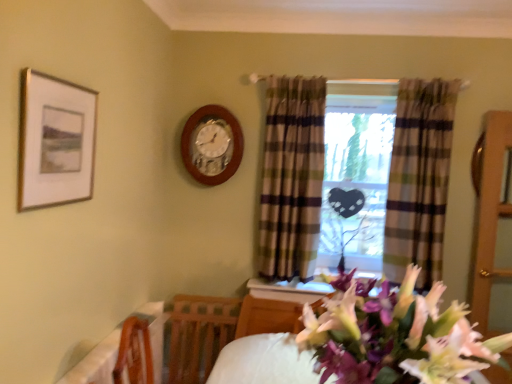
Question: Could you tell me if gold-framed picture at upper left is facing wooden table at lower left?

Choices:
 (A) yes
 (B) no

Answer: (B)

Question: Is gold-framed picture at upper left beside wooden table at lower left?

Choices:
 (A) no
 (B) yes

Answer: (A)

Question: Can you confirm if gold-framed picture at upper left is positioned to the right of wooden table at lower left?

Choices:
 (A) yes
 (B) no

Answer: (B)

Question: Is wooden table at lower left completely or partially inside gold-framed picture at upper left?

Choices:
 (A) no
 (B) yes

Answer: (A)

Question: Considering the relative positions of gold-framed picture at upper left and wooden table at lower left in the image provided, is gold-framed picture at upper left in front of wooden table at lower left?

Choices:
 (A) no
 (B) yes

Answer: (B)

Question: From a real-world perspective, is plaid fabric curtain at center, arranged as the 1th curtain when viewed from the left, above or below plaid fabric window at center?

Choices:
 (A) below
 (B) above

Answer: (B)

Question: Considering their positions, is plaid fabric curtain at center, the second curtain from the right, located in front of or behind plaid fabric window at center?

Choices:
 (A) behind
 (B) front

Answer: (B)

Question: Does point (267, 195) appear closer or farther from the camera than point (406, 261)?

Choices:
 (A) closer
 (B) farther

Answer: (B)

Question: Considering the positions of plaid fabric curtain at center, arranged as the 1th curtain when viewed from the left, and plaid fabric window at center in the image, is plaid fabric curtain at center, arranged as the 1th curtain when viewed from the left, wider or thinner than plaid fabric window at center?

Choices:
 (A) wide
 (B) thin

Answer: (B)

Question: From a real-world perspective, relative to wooden wall clock at center, is pink silky flowers at center vertically above or below?

Choices:
 (A) above
 (B) below

Answer: (B)

Question: From the image's perspective, relative to wooden wall clock at center, is pink silky flowers at center above or below?

Choices:
 (A) below
 (B) above

Answer: (A)

Question: In terms of width, does pink silky flowers at center look wider or thinner when compared to wooden wall clock at center?

Choices:
 (A) thin
 (B) wide

Answer: (B)

Question: In the image, is pink silky flowers at center on the left side or the right side of wooden wall clock at center?

Choices:
 (A) left
 (B) right

Answer: (B)

Question: From the image's perspective, is gold-framed picture at upper left positioned above or below clear glass door at right?

Choices:
 (A) above
 (B) below

Answer: (A)

Question: Visually, is gold-framed picture at upper left positioned to the left or to the right of clear glass door at right?

Choices:
 (A) right
 (B) left

Answer: (B)